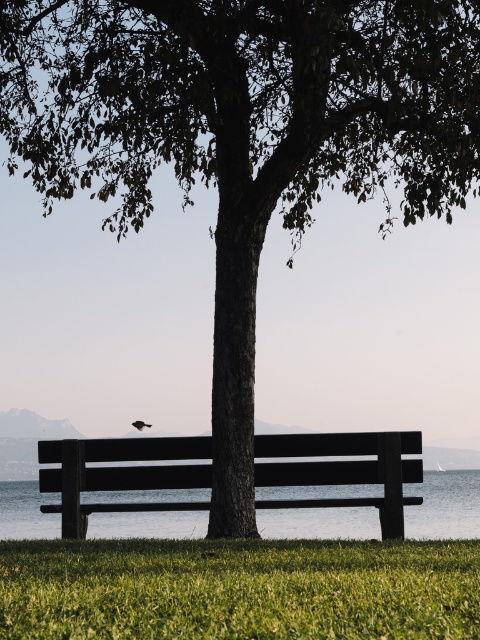
Is smooth dark wood bench at center behind silhouette feathered bird at center?

No, smooth dark wood bench at center is in front of silhouette feathered bird at center.

Does smooth dark wood bench at center appear over silhouette feathered bird at center?

No.

Between point (374, 481) and point (136, 424), which one is positioned in front?

Point (374, 481) is more forward.

Find the location of a particular element. The image size is (480, 640). smooth dark wood bench at center is located at coordinates (120, 474).

Does green grassy at lower center have a lesser width compared to silhouette feathered bird at center?

No.

Who is more forward, (267, 589) or (146, 426)?

Point (267, 589) is more forward.

The height and width of the screenshot is (640, 480). I want to click on green grassy at lower center, so click(x=239, y=589).

Does green grassy at lower center appear under smooth dark wood bench at center?

Actually, green grassy at lower center is above smooth dark wood bench at center.

Does green grassy at lower center have a greater height compared to smooth dark wood bench at center?

No, green grassy at lower center is not taller than smooth dark wood bench at center.

The image size is (480, 640). What are the coordinates of `green grassy at lower center` in the screenshot? It's located at (239, 589).

Where is `green grassy at lower center`? Image resolution: width=480 pixels, height=640 pixels. green grassy at lower center is located at coordinates coord(239,589).